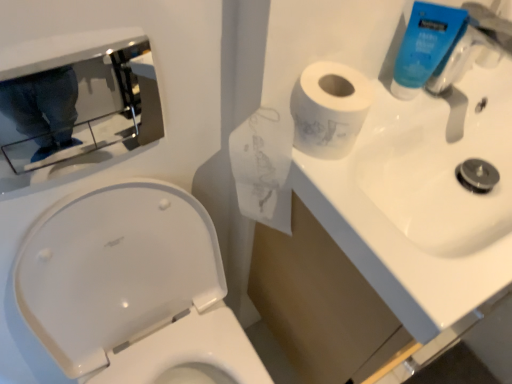
Question: From a real-world perspective, relative to blue plastic faucet at upper right, is white glossy toilet at lower left vertically above or below?

Choices:
 (A) above
 (B) below

Answer: (B)

Question: Do you think white glossy toilet at lower left is within blue plastic faucet at upper right, or outside of it?

Choices:
 (A) inside
 (B) outside

Answer: (B)

Question: Which object is the closest to the white glossy toilet at lower left?

Choices:
 (A) blue plastic faucet at upper right
 (B) blue plastic tube at upper right
 (C) white glossy sink at upper right
 (D) polished chrome mirror at upper left

Answer: (D)

Question: Which object is the farthest from the blue plastic tube at upper right?

Choices:
 (A) white glossy sink at upper right
 (B) white glossy toilet at lower left
 (C) polished chrome mirror at upper left
 (D) blue plastic faucet at upper right

Answer: (B)